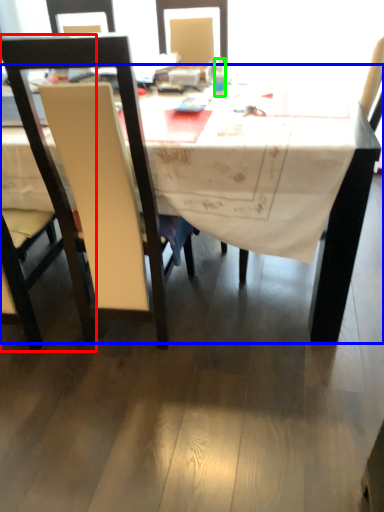
Question: Based on their relative distances, which object is nearer to chair (highlighted by a red box)? Choose from desk (highlighted by a blue box) and bottle (highlighted by a green box).

Choices:
 (A) desk
 (B) bottle

Answer: (B)